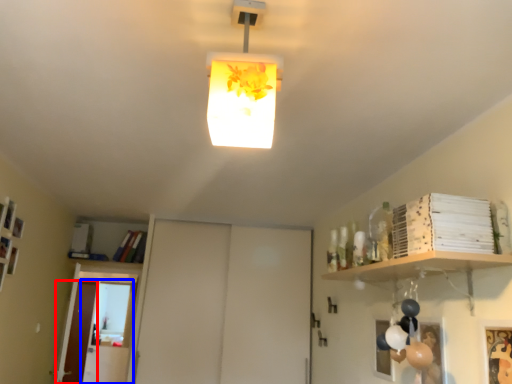
Question: Which object is closer to the camera taking this photo, door (highlighted by a red box) or glass door (highlighted by a blue box)?

Choices:
 (A) door
 (B) glass door

Answer: (B)